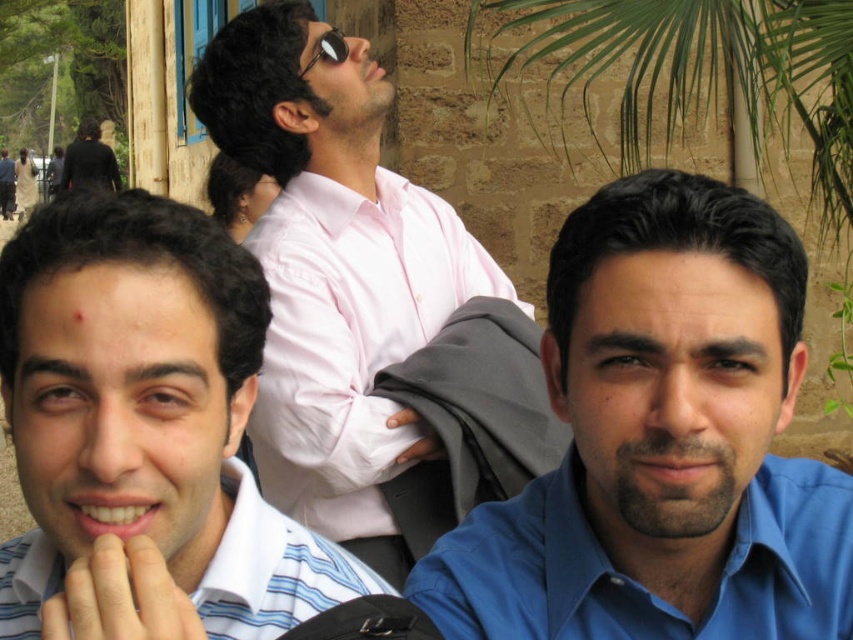
Looking at this image, you are planning to take a photo of the group and want to ensure both the pink shirt at upper center and the black matte jacket at upper left are visible. Which object should you position closer to the left side of the frame to achieve this?

To ensure both the pink shirt at upper center and the black matte jacket at upper left are visible, position the black matte jacket at upper left closer to the left side of the frame since the pink shirt at upper center is already to the right of it.

You are a photographer trying to capture a photo of the black matte jacket at upper left without the pink shirt at center blocking it. What should you do?

Move the camera to the left so that the black matte jacket at upper left is no longer behind the pink shirt at center.